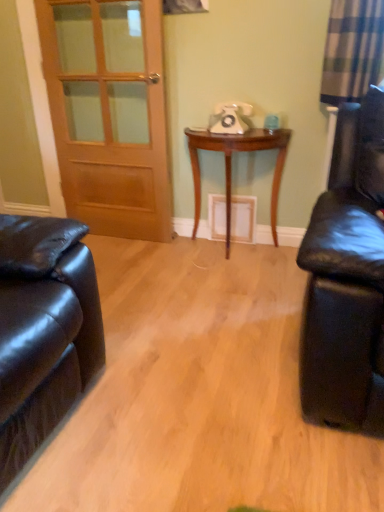
Identify the location of free space in front of woodenmaterial/texturetable at center. Image resolution: width=384 pixels, height=512 pixels. (226, 282).